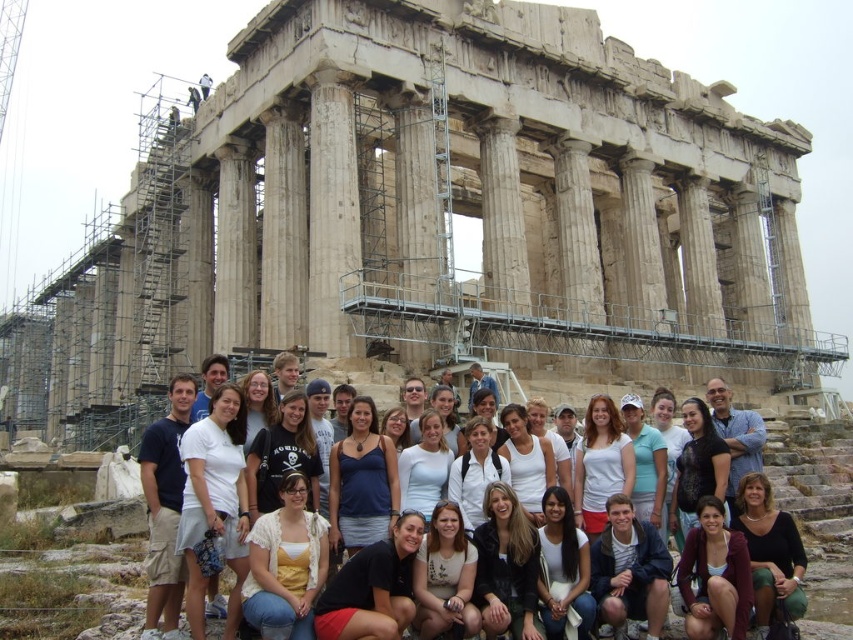
Which is above, stone columns at center or white cotton shirt at center?

stone columns at center is above.

Is point (845, 353) closer to viewer compared to point (326, 464)?

No.

In order to click on stone columns at center in this screenshot , I will do `click(434, 220)`.